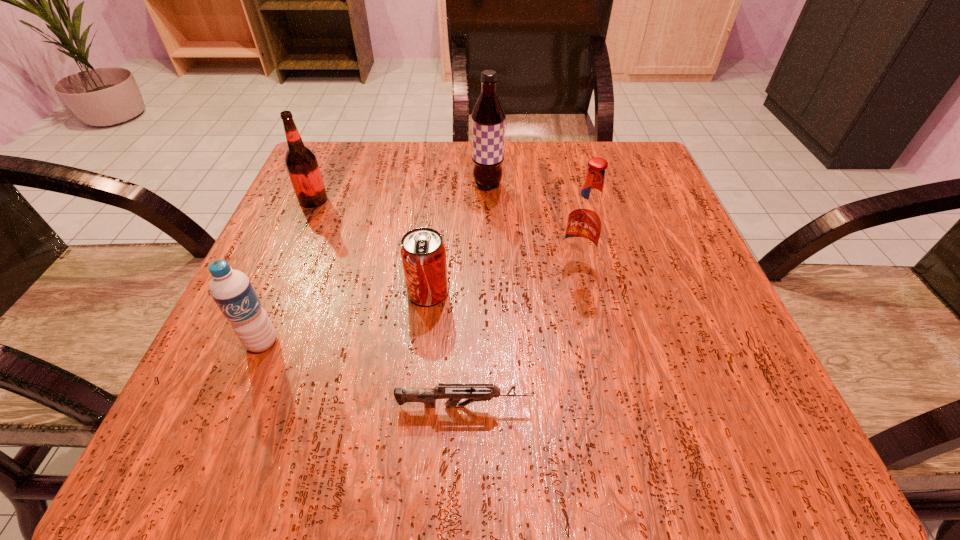
Find the location of a particular element. This screenshot has height=540, width=960. the second root beer from right to left is located at coordinates (488, 117).

I want to click on the fourth nearest object, so click(x=585, y=222).

Locate an element on the screen. This screenshot has height=540, width=960. the rightmost object is located at coordinates (585, 222).

What are the coordinates of `the leftmost root beer` in the screenshot? It's located at (301, 163).

You are a GUI agent. You are given a task and a screenshot of the screen. Output one action in this format:
    pyautogui.click(x=<x>, y=<y>)
    Task: Click on the second nearest object
    The image size is (960, 540).
    Given the screenshot: What is the action you would take?
    pyautogui.click(x=232, y=291)

The image size is (960, 540). Find the location of `the fourth tallest object`. the fourth tallest object is located at coordinates (232, 291).

At what (x,y) coordinates should I click in order to perform the action: click on the fifth tallest object. Please return your answer as a coordinate pair (x, y). Looking at the image, I should click on [423, 254].

The width and height of the screenshot is (960, 540). I want to click on pop soda, so click(423, 254).

The image size is (960, 540). In order to click on the nearest object in this screenshot , I will do `click(454, 393)`.

The width and height of the screenshot is (960, 540). Find the location of `the shortest object`. the shortest object is located at coordinates (454, 393).